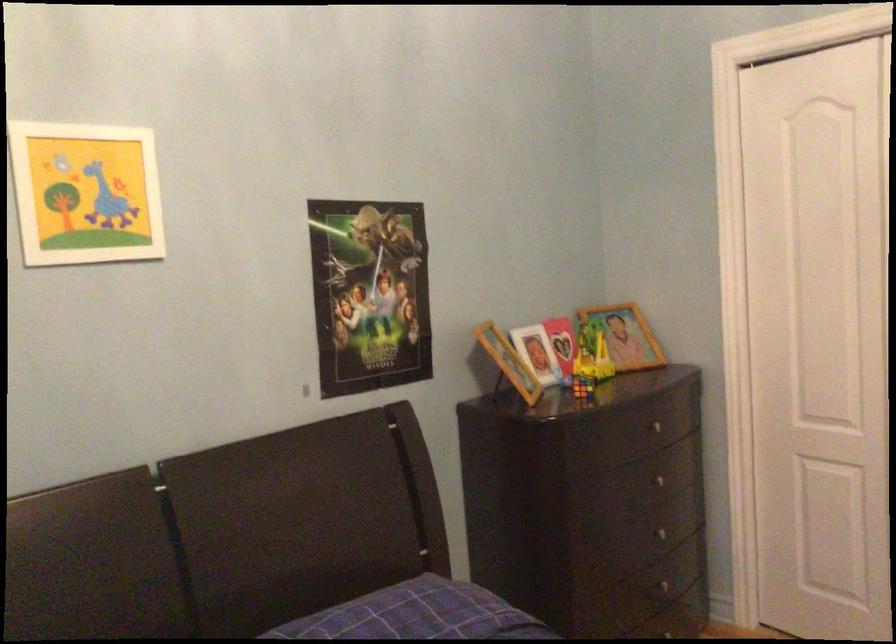
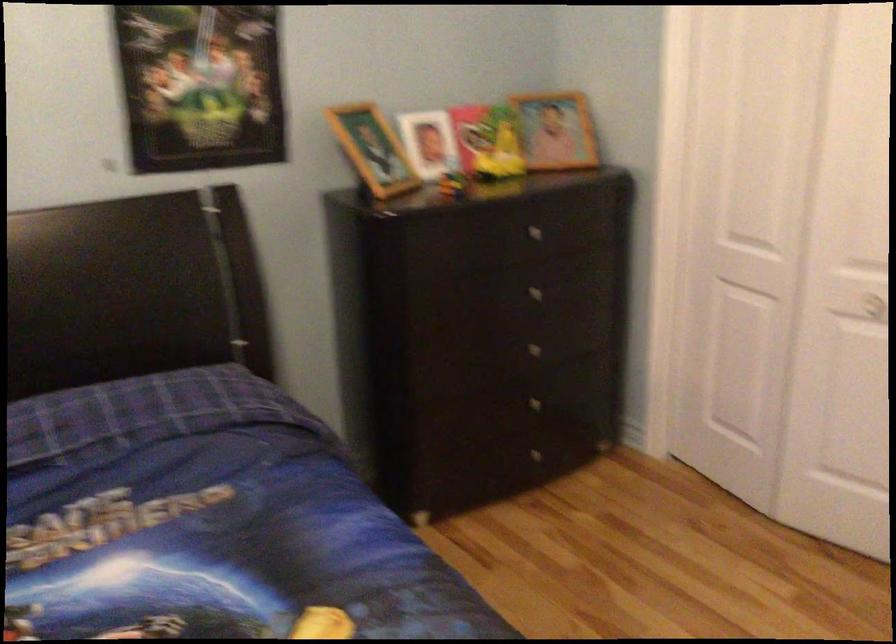
In the second image, find the point that corresponds to (665,486) in the first image.

(538, 292)